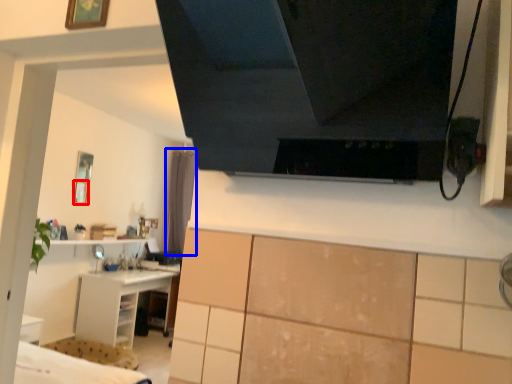
Question: Among these objects, which one is nearest to the camera, picture frame (highlighted by a red box) or curtain (highlighted by a blue box)?

Choices:
 (A) picture frame
 (B) curtain

Answer: (A)